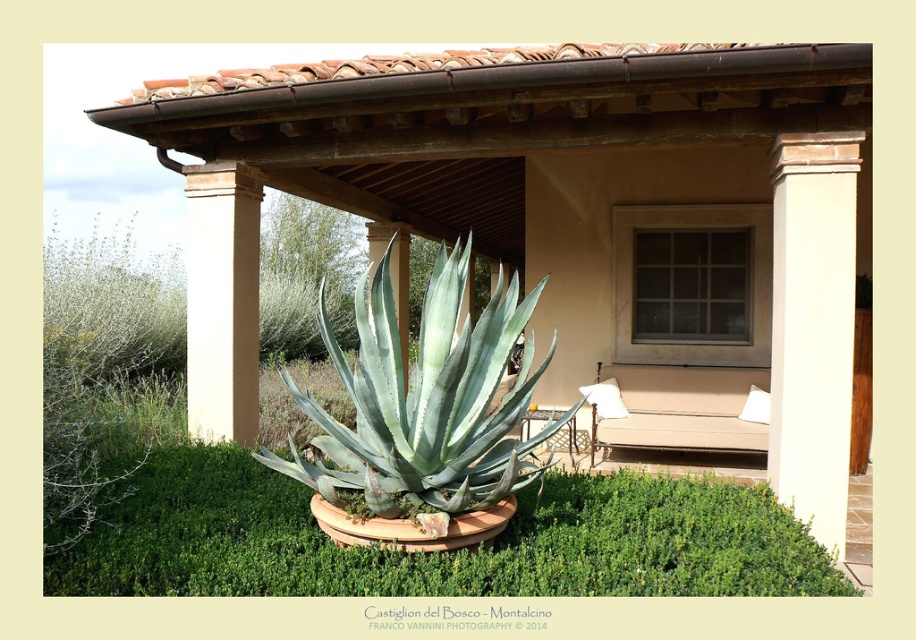
You are standing on the patio and want to place a small decorative item on the ground between the green succulent at center and the beige smooth column at center. Can you fit it there?

The green succulent at center is located below beige smooth column at center, so there is space between them to place the decorative item.

You are designing a garden layout and need to place a new statue that requires a base larger than the green succulent at center. Can the white smooth column at right serve as a suitable base for the statue?

The green succulent at center is bigger than the white smooth column at right. Since the statue requires a base larger than the green succulent at center, the white smooth column at right is not large enough to serve as a suitable base for the statue.

Based on the photo, you are planning to place a new bench in the outdoor patio area. The bench requires a space larger than the white smooth column at right. Based on the scene, is the brown wood pergola at center a suitable location for placing the bench?

The brown wood pergola at center is bigger than the white smooth column at right, so yes, the brown wood pergola at center is a suitable location for placing the bench since it provides enough space larger than the white smooth column at right.